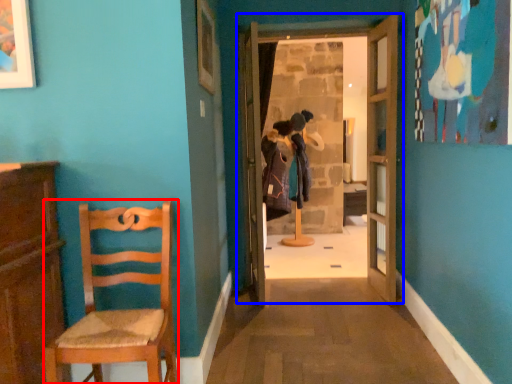
Question: Which point is closer to the camera, chair (highlighted by a red box) or door (highlighted by a blue box)?

Choices:
 (A) chair
 (B) door

Answer: (A)